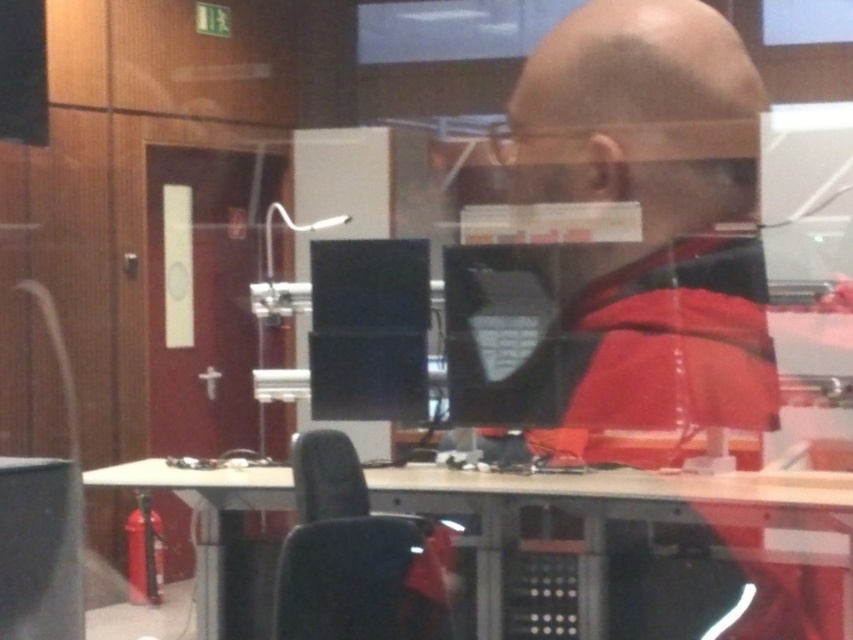
Who is lower down, wooden table at center or black fabric chair at lower center?

Positioned lower is wooden table at center.

Which is more to the left, wooden table at center or black fabric chair at lower center?

Answer: Positioned to the left is black fabric chair at lower center.

Which is behind, point (596, 593) or point (306, 458)?

The point (596, 593) is behind.

The image size is (853, 640). What are the coordinates of `wooden table at center` in the screenshot? It's located at (614, 513).